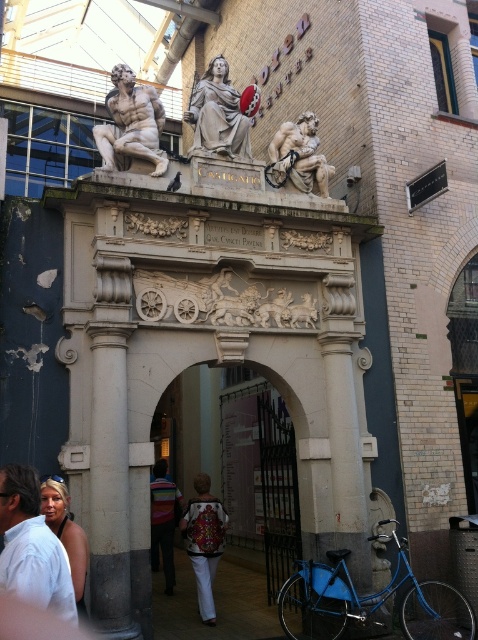
Between matte black tank top at lower left and striped shirt at center, which one has more height?

matte black tank top at lower left is taller.

Does matte black tank top at lower left have a greater width compared to striped shirt at center?

Yes, matte black tank top at lower left is wider than striped shirt at center.

Measure the distance between point (65, 548) and camera.

They are 45.14 feet apart.

The height and width of the screenshot is (640, 478). In order to click on matte black tank top at lower left in this screenshot , I will do `click(65, 532)`.

Which is in front, point (156, 100) or point (238, 131)?

Point (156, 100) is in front.

The height and width of the screenshot is (640, 478). Find the location of `white marble statue at upper center`. white marble statue at upper center is located at coordinates (131, 122).

Is point (161, 115) behind point (232, 118)?

No, it is in front of (232, 118).

Find the location of a particular element. white marble statue at upper center is located at coordinates (131, 122).

Is matte gray statue at center positioned at the back of rough stone sculpture at center?

No, matte gray statue at center is in front of rough stone sculpture at center.

I want to click on matte gray statue at center, so click(217, 113).